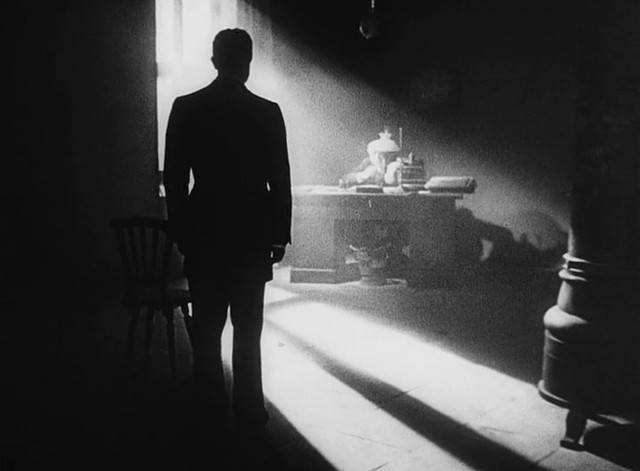
The image size is (640, 471). In order to click on window in this screenshot , I will do `click(196, 30)`.